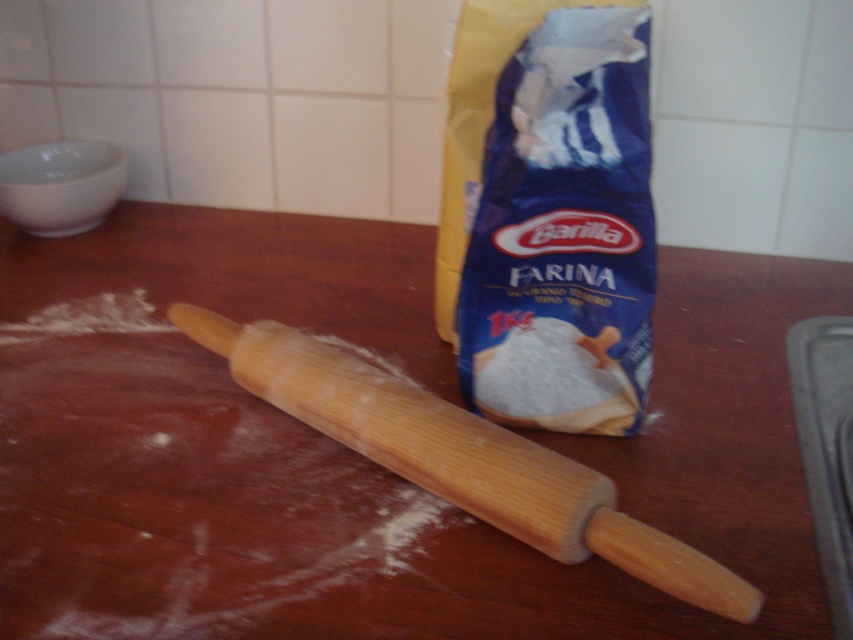
Can you confirm if blue paper bag at upper right is positioned above wooden rolling pin at center?

Correct, blue paper bag at upper right is located above wooden rolling pin at center.

Is point (492, 168) positioned before point (350, 371)?

Yes.

Identify the location of blue paper bag at upper right. (549, 212).

Which is more to the left, white powder at rolling pin left or wooden rolling pin at center?

From the viewer's perspective, white powder at rolling pin left appears more on the left side.

Can you confirm if white powder at rolling pin left is bigger than wooden rolling pin at center?

Yes, white powder at rolling pin left is bigger than wooden rolling pin at center.

Does point (334, 484) lie behind point (518, 532)?

Yes, it is.

This screenshot has width=853, height=640. What are the coordinates of `white powder at rolling pin left` in the screenshot? It's located at (194, 499).

Is white powder at rolling pin left above blue paper bag at upper right?

Incorrect, white powder at rolling pin left is not positioned above blue paper bag at upper right.

Is point (212, 474) in front of point (498, 35)?

That is False.

This screenshot has height=640, width=853. What are the coordinates of `white powder at rolling pin left` in the screenshot? It's located at (194, 499).